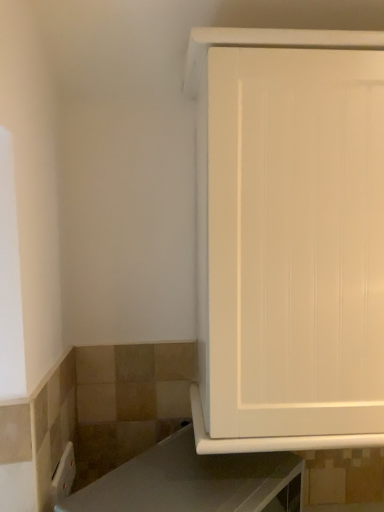
I want to click on free point above white glossy countertop at lower right (from a real-world perspective), so click(x=196, y=477).